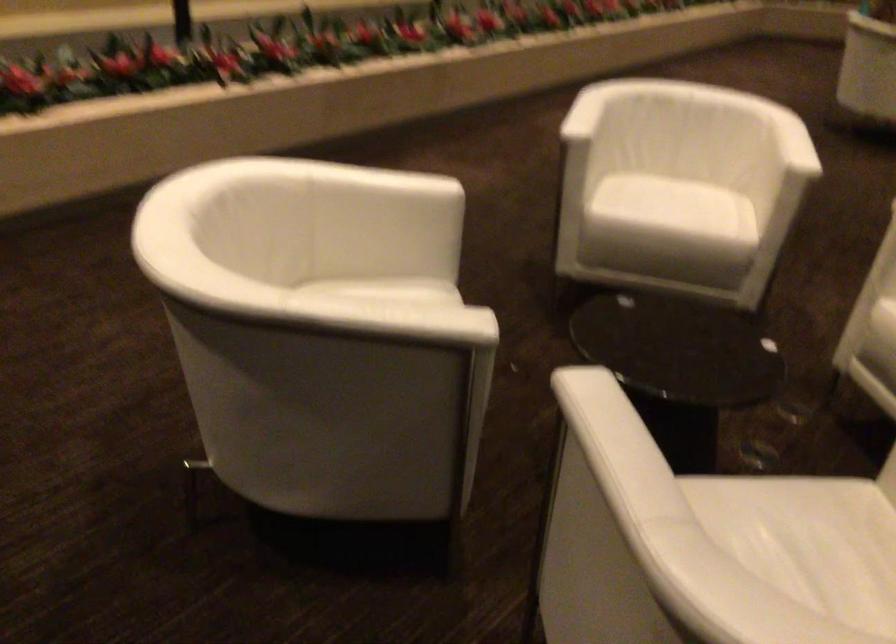
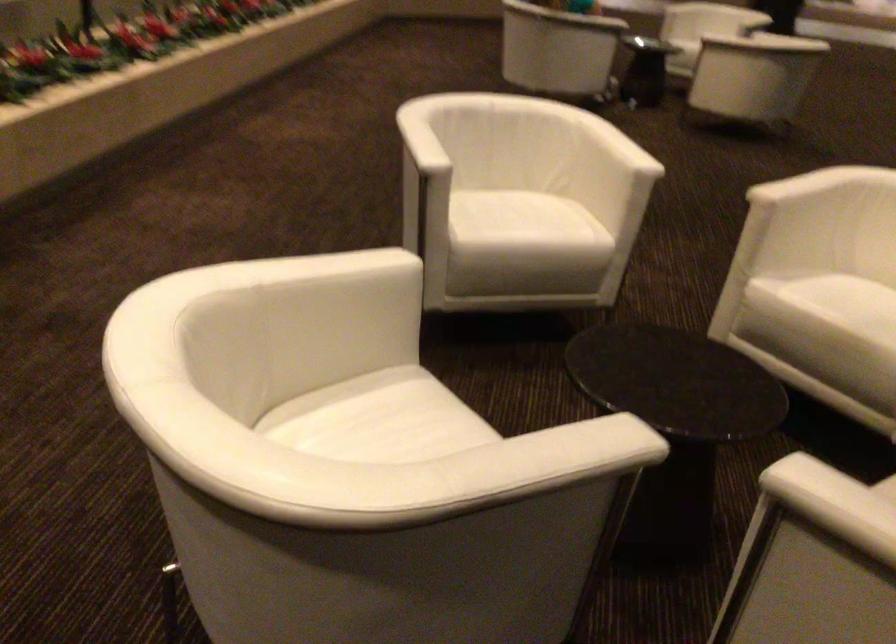
The images are taken continuously from a first-person perspective. In which direction are you moving?

The cameraman walked toward left, forward.